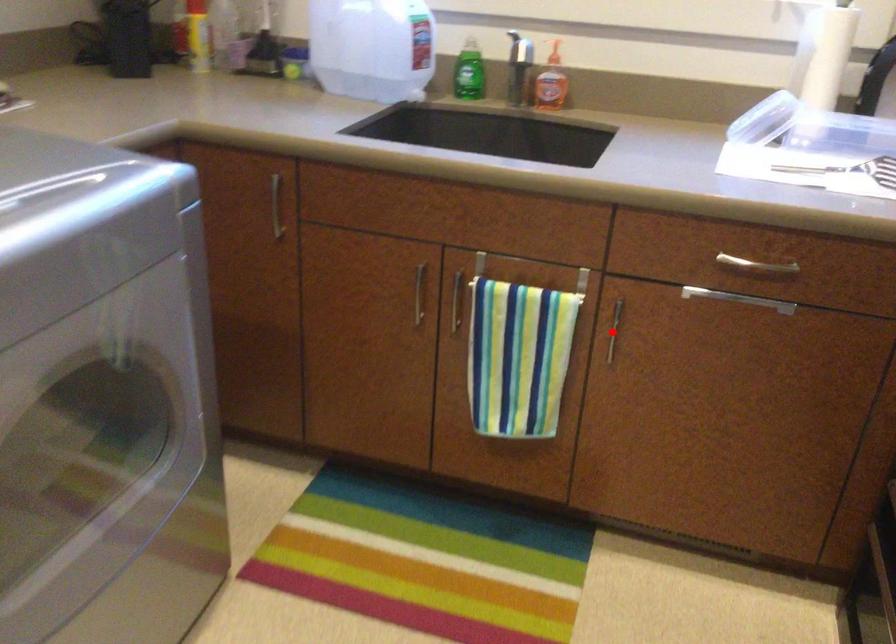
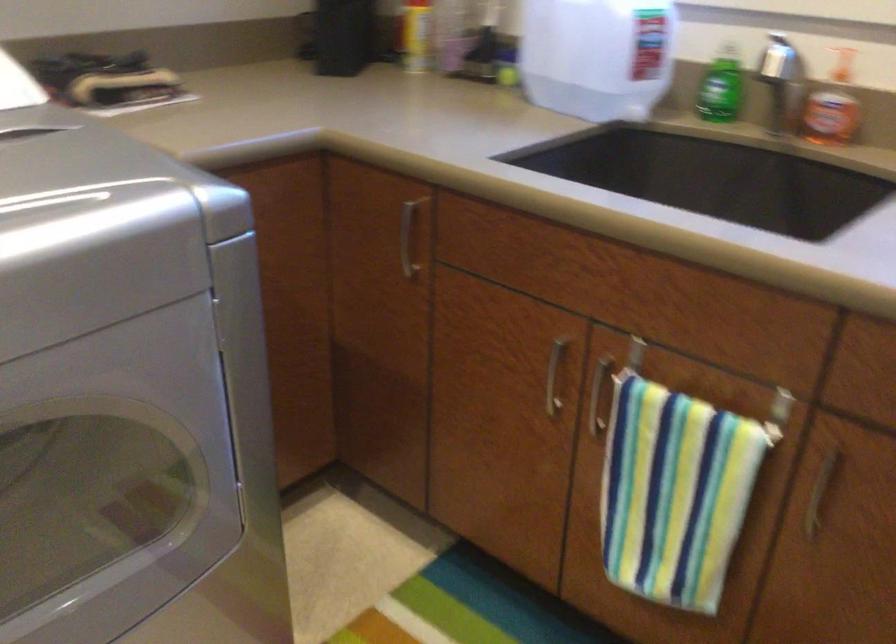
Find the pixel in the second image that matches the highlighted location in the first image.

(819, 494)